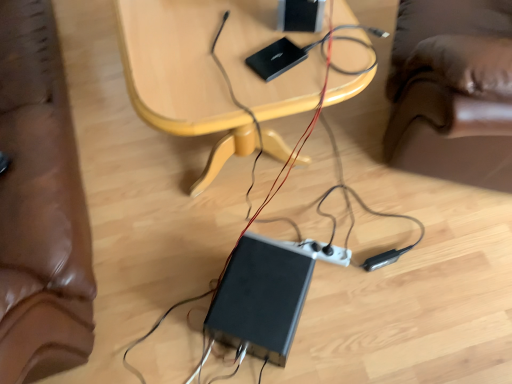
Where is `blank space situated above black plastic computer at lower center (from a real-world perspective)`? The image size is (512, 384). blank space situated above black plastic computer at lower center (from a real-world perspective) is located at coordinates 262,281.